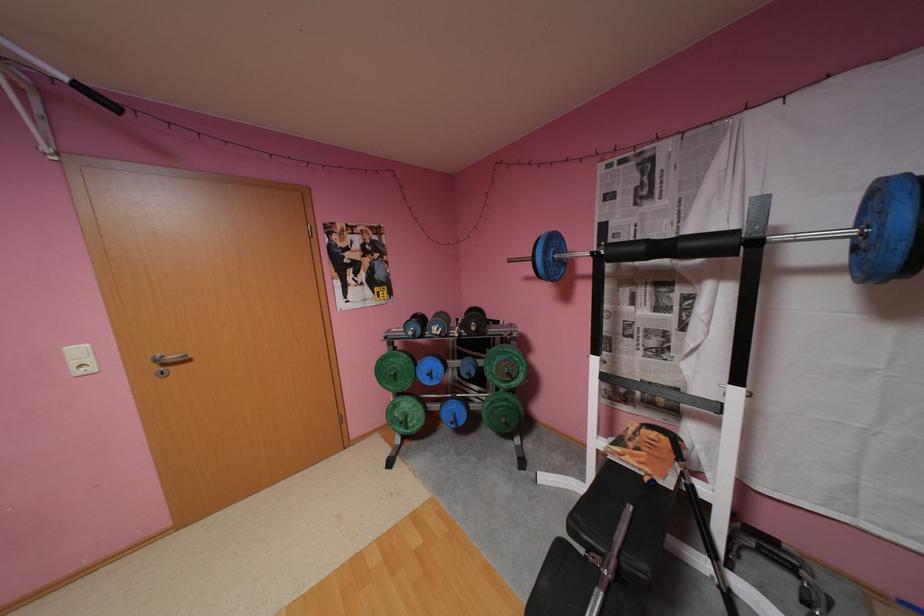
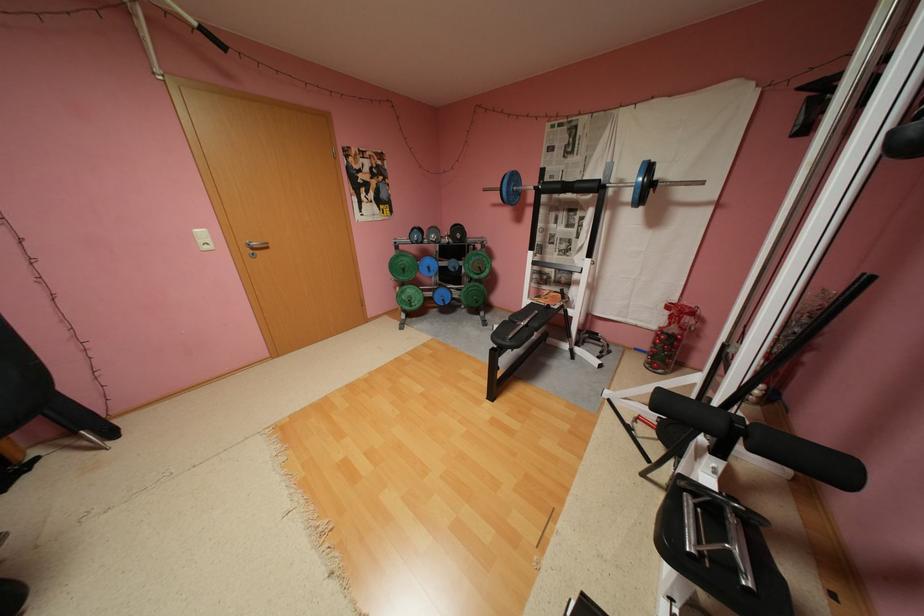
Find the pixel in the second image that matches the point at 517,374 in the first image.

(489, 267)